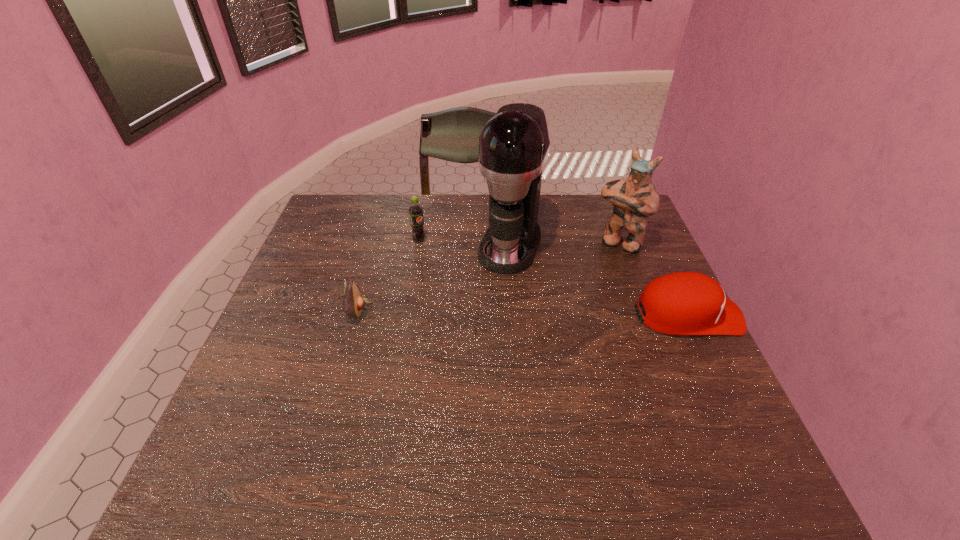
Locate an element on the screen. figurine that is at the right edge is located at coordinates (634, 199).

At what (x,y) coordinates should I click in order to perform the action: click on object present at the far right corner. Please return your answer as a coordinate pair (x, y). This screenshot has width=960, height=540. Looking at the image, I should click on (634, 199).

You are a GUI agent. You are given a task and a screenshot of the screen. Output one action in this format:
    pyautogui.click(x=<x>, y=<y>)
    Task: Click on the free space at the far edge
    
    Given the screenshot: What is the action you would take?
    pyautogui.click(x=427, y=203)

Where is `free space at the near edge of the desktop`? The height and width of the screenshot is (540, 960). free space at the near edge of the desktop is located at coordinates (598, 422).

This screenshot has width=960, height=540. In order to click on free space at the right edge of the desktop in this screenshot , I will do `click(685, 367)`.

Image resolution: width=960 pixels, height=540 pixels. What are the coordinates of `free space at the far left corner` in the screenshot? It's located at (362, 216).

This screenshot has width=960, height=540. In order to click on vacant space at the far right corner of the desktop in this screenshot , I will do `click(594, 222)`.

Locate an element on the screen. empty location between the second tallest object and the baseball cap is located at coordinates (654, 279).

This screenshot has height=540, width=960. I want to click on free space between the avocado and the baseball cap, so (x=523, y=313).

Locate an element on the screen. Image resolution: width=960 pixels, height=540 pixels. free space between the soda and the coffee maker is located at coordinates (465, 243).